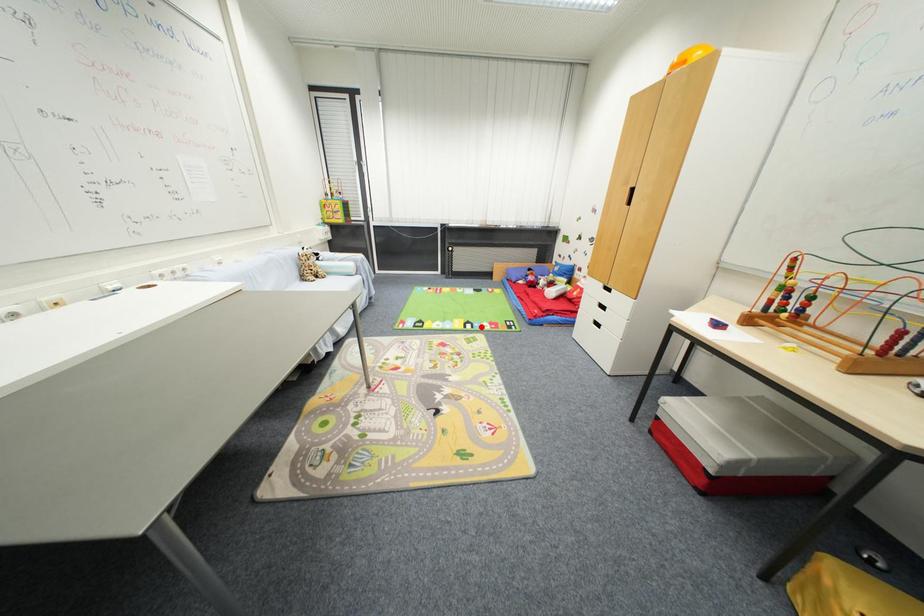
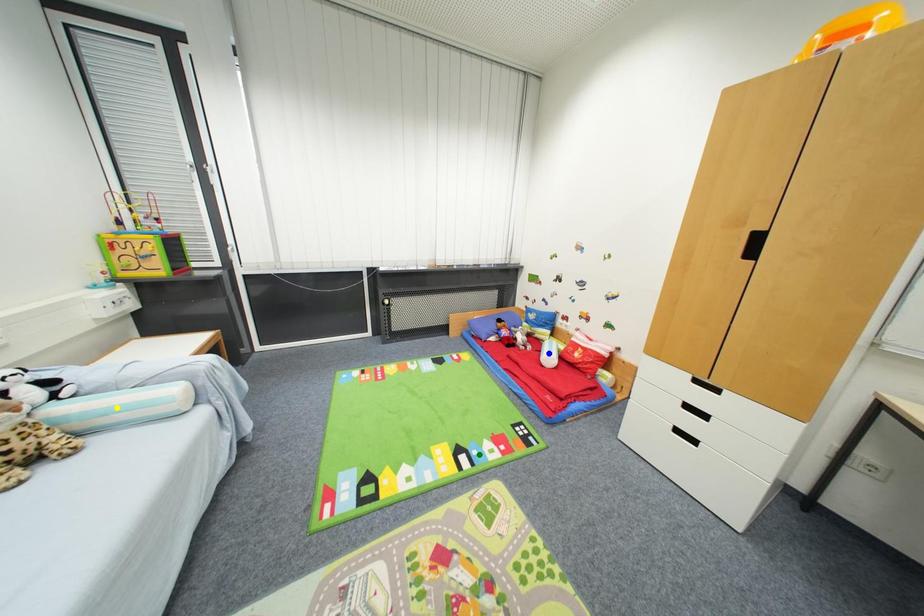
Question: I am providing you with two images of the same scene from different viewpoints. A red point is marked on the first image. You are given multiple points on the second image. Which point in image 2 represents the same 3d spot as the red point in image 1?

Choices:
 (A) blue point
 (B) yellow point
 (C) green point

Answer: (C)